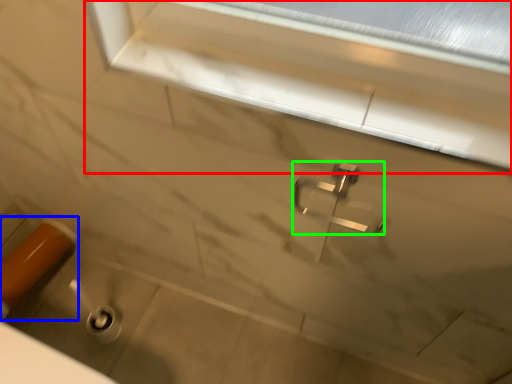
Question: Which object is the closest to the window frame (highlighted by a red box)? Choose among these: door handle (highlighted by a blue box) or tap (highlighted by a green box).

Choices:
 (A) door handle
 (B) tap

Answer: (B)